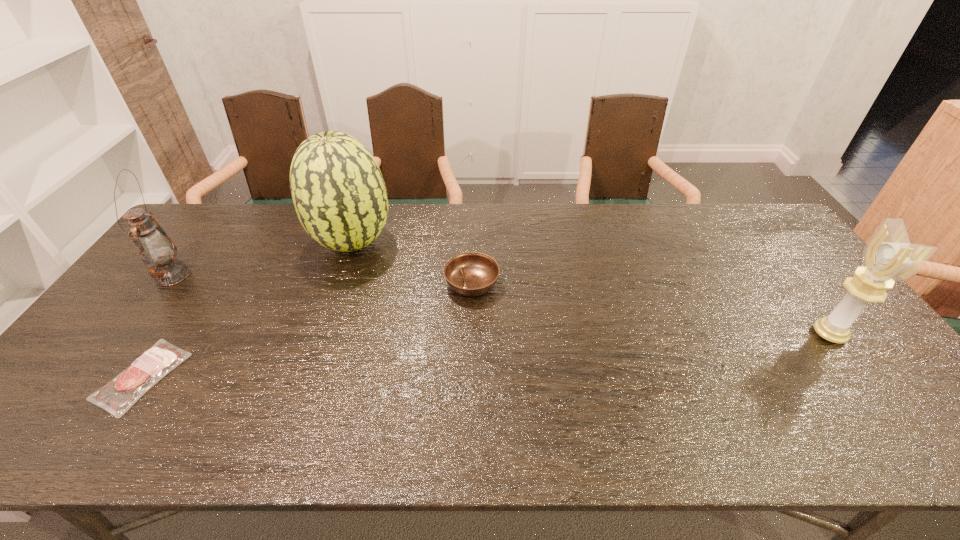
This screenshot has width=960, height=540. Identify the location of free region at the left edge of the desktop. (79, 362).

Where is `vacant space at the right edge`? vacant space at the right edge is located at coordinates (796, 252).

Identify the location of free region at the far right corner. point(733,207).

Locate an element on the screen. free area in between the oil lamp and the shortest object is located at coordinates (157, 326).

Locate an element on the screen. free spot between the oil lamp and the watermelon is located at coordinates (263, 259).

Image resolution: width=960 pixels, height=540 pixels. I want to click on vacant space that is in between the shortest object and the watermelon, so [248, 309].

I want to click on free space between the steak and the oil lamp, so click(x=157, y=326).

Find the location of a particular element. Image resolution: width=960 pixels, height=540 pixels. empty space that is in between the award and the oil lamp is located at coordinates (501, 305).

Find the location of a particular element. free space that is in between the oil lamp and the rightmost object is located at coordinates (501, 305).

Identify the location of free space between the watermelon and the oil lamp. (263, 259).